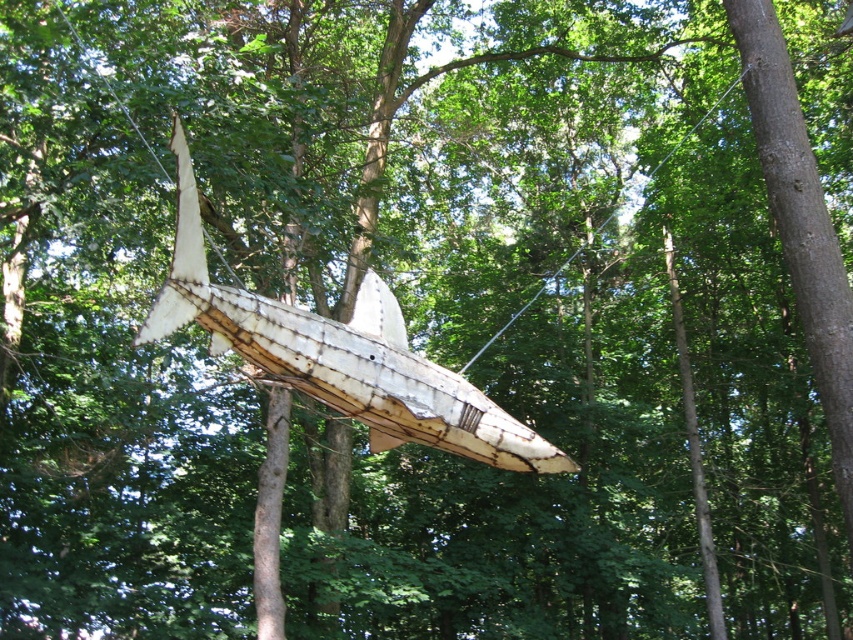
Question: Which object appears farthest from the camera in this image?

Choices:
 (A) clear wire at center
 (B) rusty wood boat at center

Answer: (A)

Question: Which point is farther from the camera taking this photo?

Choices:
 (A) (666, 157)
 (B) (306, 378)

Answer: (A)

Question: Observing the image, what is the correct spatial positioning of rusty wood boat at center in reference to clear wire at center?

Choices:
 (A) right
 (B) left

Answer: (B)

Question: Can you confirm if rusty wood boat at center is smaller than clear wire at center?

Choices:
 (A) no
 (B) yes

Answer: (B)

Question: Is rusty wood boat at center to the right of clear wire at center from the viewer's perspective?

Choices:
 (A) no
 (B) yes

Answer: (A)

Question: Which point is closer to the camera taking this photo?

Choices:
 (A) (643, 188)
 (B) (358, 312)

Answer: (B)